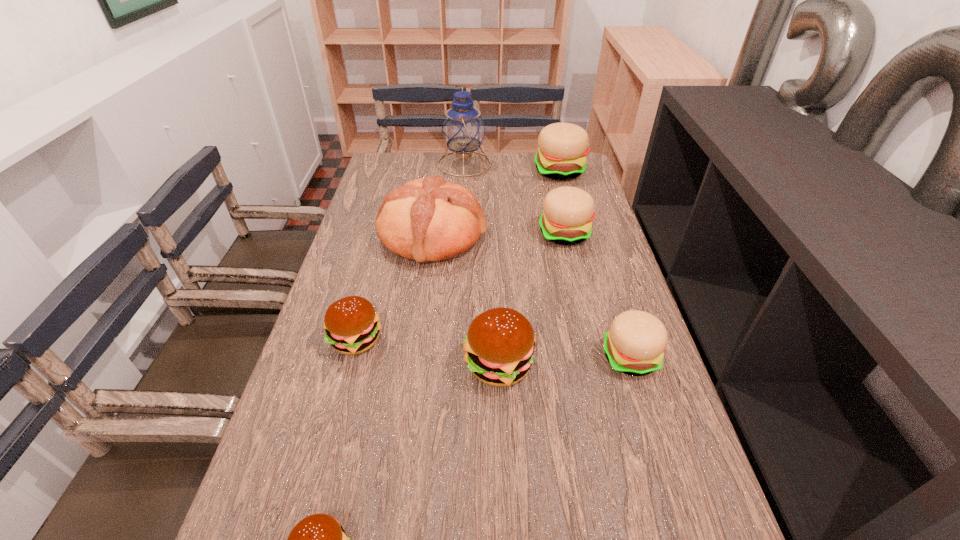
Locate an element on the screen. This screenshot has width=960, height=540. vacant region that satisfies the following two spatial constraints: 1. on the front-facing side of the blue lantern; 2. on the right side of the rightmost brown hamburger is located at coordinates (453, 364).

What are the coordinates of `blank space that satisfies the following two spatial constraints: 1. on the front side of the rightmost brown hamburger; 2. on the left side of the bread` in the screenshot? It's located at (415, 364).

The height and width of the screenshot is (540, 960). In order to click on free space that satisfies the following two spatial constraints: 1. on the front-facing side of the blue lantern; 2. on the front side of the second biggest brown hamburger in this screenshot , I will do `click(454, 340)`.

Image resolution: width=960 pixels, height=540 pixels. Identify the location of vacant region that satisfies the following two spatial constraints: 1. on the front side of the nearest beige hamburger; 2. on the left side of the bread. (416, 357).

This screenshot has height=540, width=960. In order to click on blank space that satisfies the following two spatial constraints: 1. on the front side of the biggest brown hamburger; 2. on the left side of the bread in this screenshot , I will do `click(415, 364)`.